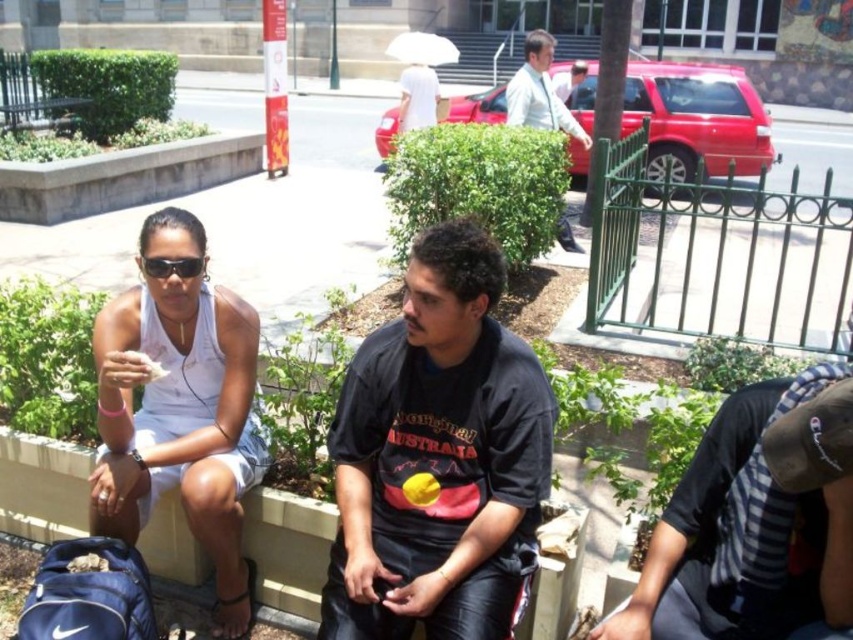
Question: Is striped shirt at lower right to the left of wooden park bench at center from the viewer's perspective?

Choices:
 (A) no
 (B) yes

Answer: (A)

Question: Among these objects, which one is nearest to the camera?

Choices:
 (A) white fabric tank top at left
 (B) matte black sunglasses at upper left

Answer: (A)

Question: Is white fabric tank top at left to the right of light blue shirt at center from the viewer's perspective?

Choices:
 (A) yes
 (B) no

Answer: (B)

Question: Is black matte shirt at center smaller than wooden park bench at center?

Choices:
 (A) no
 (B) yes

Answer: (B)

Question: Among these objects, which one is nearest to the camera?

Choices:
 (A) matte black sunglasses at upper left
 (B) black matte shirt at center
 (C) white fabric tank top at left
 (D) striped shirt at lower right

Answer: (D)

Question: Considering the real-world distances, which object is farthest from the striped shirt at lower right?

Choices:
 (A) white fabric tank top at left
 (B) light blue shirt at center
 (C) matte black sunglasses at upper left

Answer: (B)